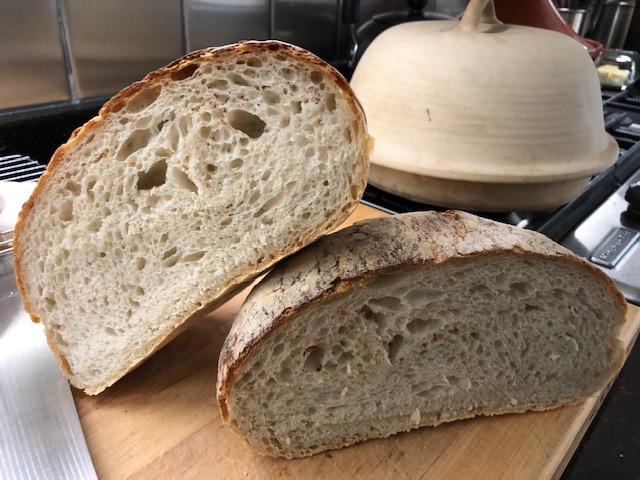
Find the location of `light`. light is located at coordinates (22, 339).